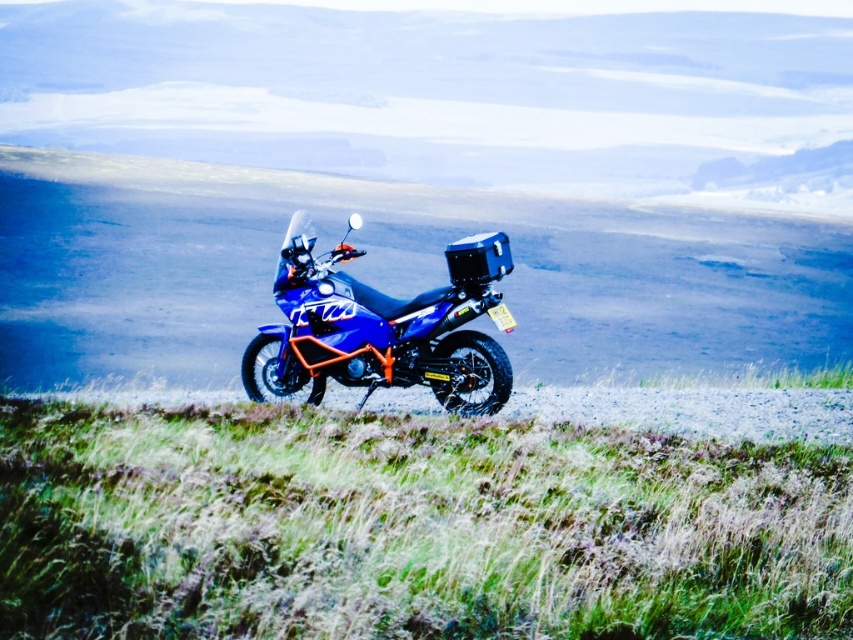
Question: Is green grassy at center thinner than blue matte motorcycle at center?

Choices:
 (A) yes
 (B) no

Answer: (B)

Question: From the image, what is the correct spatial relationship of green grassy at center in relation to blue matte motorcycle at center?

Choices:
 (A) right
 (B) left

Answer: (A)

Question: Which of the following is the closest to the observer?

Choices:
 (A) (416, 384)
 (B) (786, 508)

Answer: (B)

Question: Which point is closer to the camera taking this photo?

Choices:
 (A) (415, 496)
 (B) (437, 340)

Answer: (A)

Question: From the image, what is the correct spatial relationship of green grassy at center in relation to blue matte motorcycle at center?

Choices:
 (A) above
 (B) below

Answer: (B)